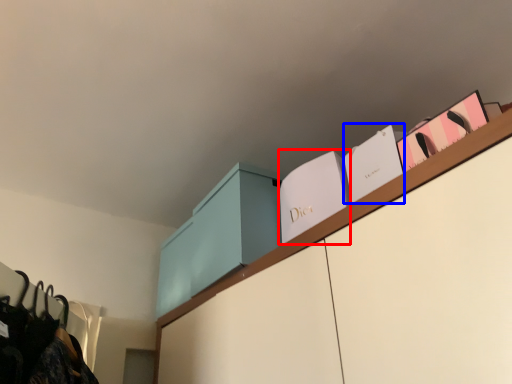
Question: Which object is closer to the camera taking this photo, book (highlighted by a red box) or book (highlighted by a blue box)?

Choices:
 (A) book
 (B) book

Answer: (B)